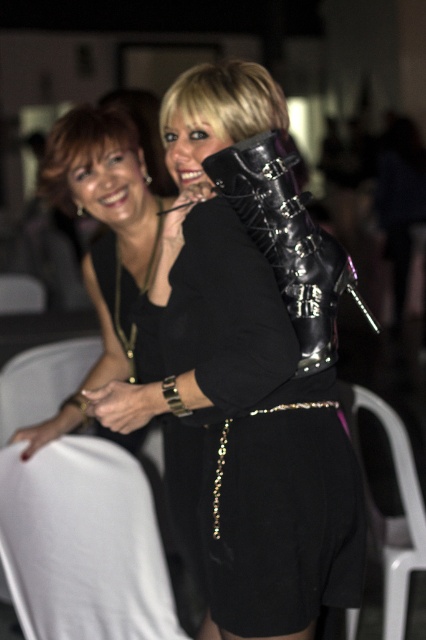
Question: Can you confirm if black leather dress at center is smaller than shiny black boot at center?

Choices:
 (A) yes
 (B) no

Answer: (B)

Question: Considering the relative positions of black leather dress at center and matte black hair at upper left in the image provided, where is black leather dress at center located with respect to matte black hair at upper left?

Choices:
 (A) right
 (B) left

Answer: (A)

Question: Which point appears closest to the camera in this image?

Choices:
 (A) (267, 83)
 (B) (72, 204)
 (C) (350, 465)
 (D) (365, 396)

Answer: (C)

Question: Is matte black dress at upper center to the left of matte black hair at upper left from the viewer's perspective?

Choices:
 (A) yes
 (B) no

Answer: (B)

Question: Which point appears farthest from the camera in this image?

Choices:
 (A) (57, 196)
 (B) (405, 541)

Answer: (B)

Question: Which object is farther from the camera taking this photo?

Choices:
 (A) matte black hair at upper left
 (B) black leather dress at center
 (C) shiny black boot at center

Answer: (A)